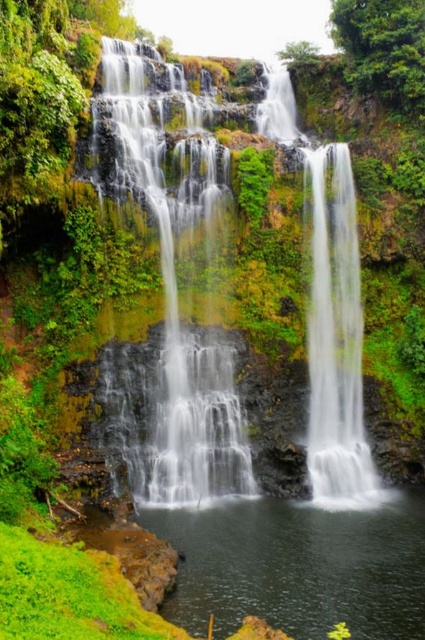
Question: Does white textured waterfall at center have a smaller size compared to smooth gray rock at center?

Choices:
 (A) no
 (B) yes

Answer: (A)

Question: Which point is closer to the camera?

Choices:
 (A) (180, 356)
 (B) (138, 516)

Answer: (B)

Question: Which point is farther to the camera?

Choices:
 (A) (235, 536)
 (B) (337, 300)
 (C) (155, 394)

Answer: (B)

Question: Which object appears farthest from the camera in this image?

Choices:
 (A) clear water at center
 (B) white textured waterfall at center
 (C) smooth gray rock at center

Answer: (C)

Question: Does white textured waterfall at center have a smaller size compared to clear water at center?

Choices:
 (A) yes
 (B) no

Answer: (B)

Question: Where is white textured waterfall at center located in relation to clear water at center in the image?

Choices:
 (A) left
 (B) right

Answer: (A)